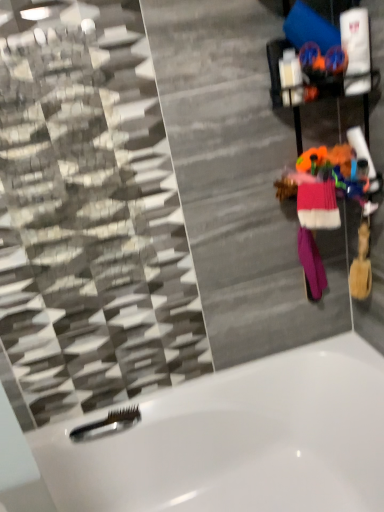
Question: Does point (102, 420) appear closer or farther from the camera than point (299, 204)?

Choices:
 (A) farther
 (B) closer

Answer: (A)

Question: In the image, is black plastic comb at lower left positioned in front of or behind pink knitted sweater at right, which is counted as the second clothing, starting from the back?

Choices:
 (A) front
 (B) behind

Answer: (B)

Question: Estimate the real-world distances between objects in this image. Which object is farther from the purple knitted mittens at right, placed as the 1th clothing when sorted from back to front?

Choices:
 (A) pink knitted sweater at right, which is counted as the second clothing, starting from the back
 (B) white glossy bathtub at lower center
 (C) black plastic comb at lower left

Answer: (C)

Question: Which of these objects is positioned farthest from the pink knitted sweater at right, which is counted as the second clothing, starting from the back?

Choices:
 (A) white glossy bathtub at lower center
 (B) purple knitted mittens at right, which ranks as the 2th clothing in front-to-back order
 (C) black plastic comb at lower left

Answer: (C)